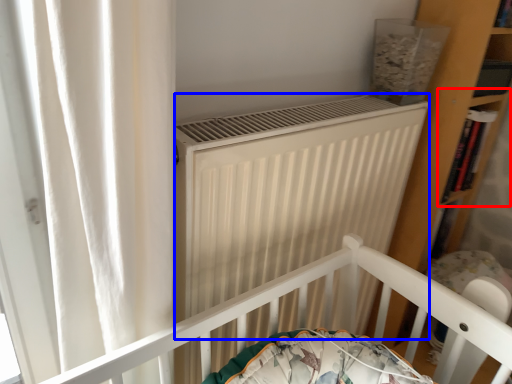
Question: Among these objects, which one is nearest to the camera, shelf (highlighted by a red box) or heater (highlighted by a blue box)?

Choices:
 (A) shelf
 (B) heater

Answer: (B)